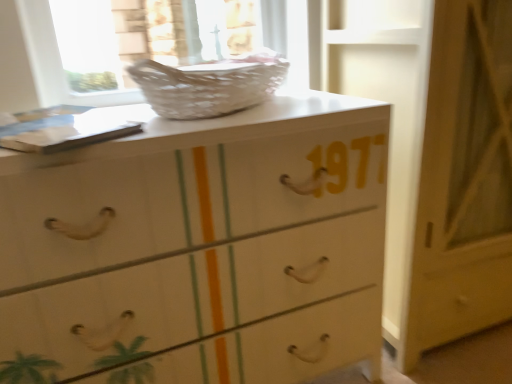
The image size is (512, 384). In order to click on white wicker basket at upper center in this screenshot , I will do `click(206, 87)`.

Locate an element on the screen. The height and width of the screenshot is (384, 512). white wicker basket at upper center is located at coordinates (206, 87).

Is the surface of white glossy door at center in direct contact with white glossy chest of drawers at center?

white glossy door at center and white glossy chest of drawers at center are not in contact.

Can you confirm if white glossy door at center is wider than white glossy chest of drawers at center?

Yes.

Can you confirm if white glossy door at center is positioned to the right of white glossy chest of drawers at center?

Yes.

Does white glossy door at center have a smaller size compared to white glossy chest of drawers at center?

No, white glossy door at center is not smaller than white glossy chest of drawers at center.

From a real-world perspective, which is physically above, white glossy door at center or white wicker basket at upper center?

white wicker basket at upper center, from a real-world perspective.

Who is smaller, white glossy door at center or white wicker basket at upper center?

white wicker basket at upper center is smaller.

Which is farther, (x=319, y=52) or (x=206, y=78)?

The point (x=319, y=52) is more distant.

Who is smaller, white glossy chest of drawers at center or white glossy door at center?

Smaller between the two is white glossy chest of drawers at center.

Considering the positions of points (55, 229) and (417, 149), is point (55, 229) closer to camera compared to point (417, 149)?

Yes, point (55, 229) is in front of point (417, 149).

Between white glossy chest of drawers at center and white glossy door at center, which one appears on the right side from the viewer's perspective?

white glossy door at center is more to the right.

Can you confirm if white glossy chest of drawers at center is wider than white glossy door at center?

Incorrect, the width of white glossy chest of drawers at center does not surpass that of white glossy door at center.

Is white wicker basket at upper center inside the boundaries of white glossy door at center, or outside?

The correct answer is: outside.

Does white wicker basket at upper center have a smaller size compared to white glossy door at center?

Correct, white wicker basket at upper center occupies less space than white glossy door at center.

Can you confirm if white wicker basket at upper center is wider than white glossy door at center?

In fact, white wicker basket at upper center might be narrower than white glossy door at center.

Identify the location of basket in front of the white glossy door at center. Image resolution: width=512 pixels, height=384 pixels. (206, 87).

Could you tell me if white glossy chest of drawers at center is facing white wicker basket at upper center?

No, white glossy chest of drawers at center does not turn towards white wicker basket at upper center.

Which object is more forward, white glossy chest of drawers at center or white wicker basket at upper center?

white glossy chest of drawers at center.

Can you see white glossy chest of drawers at center touching white wicker basket at upper center?

No.

Does white wicker basket at upper center appear on the right side of white glossy chest of drawers at center?

Indeed, white wicker basket at upper center is positioned on the right side of white glossy chest of drawers at center.

Is white glossy chest of drawers at center completely or partially inside white wicker basket at upper center?

That's incorrect, white glossy chest of drawers at center is not inside white wicker basket at upper center.

Which point is more forward, (198, 106) or (288, 348)?

The point (198, 106) is more forward.

Locate an element on the screen. The image size is (512, 384). the chest of drawers that is in front of the white glossy door at center is located at coordinates (198, 248).

I want to click on door located underneath the white wicker basket at upper center (from a real-world perspective), so click(385, 101).

Looking at the image, which one is located closer to white glossy chest of drawers at center, white glossy door at center or white wicker basket at upper center?

white wicker basket at upper center.

Based on their spatial positions, is white glossy chest of drawers at center or white glossy door at center closer to white wicker basket at upper center?

Among the two, white glossy chest of drawers at center is located nearer to white wicker basket at upper center.

Looking at the image, which one is located closer to white glossy door at center, white wicker basket at upper center or white glossy chest of drawers at center?

white glossy chest of drawers at center.

Considering their positions, is white wicker basket at upper center positioned further to white glossy chest of drawers at center than white glossy door at center?

Based on the image, white glossy door at center appears to be further to white glossy chest of drawers at center.

Looking at this image, considering their positions, is white glossy chest of drawers at center positioned further to white glossy door at center than white wicker basket at upper center?

Among the two, white wicker basket at upper center is located further to white glossy door at center.

Looking at the image, which one is located further to white wicker basket at upper center, white glossy door at center or white glossy chest of drawers at center?

white glossy door at center.

Locate an element on the screen. basket situated between white glossy chest of drawers at center and white glossy door at center from left to right is located at coordinates (206, 87).